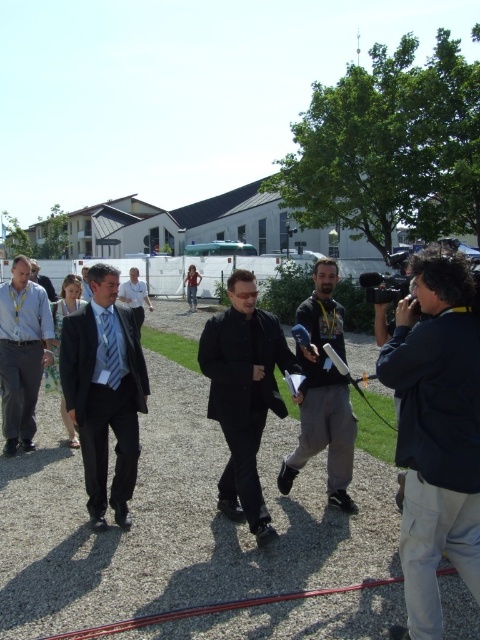
You are a photographer at the media event. You need to capture a photo of the light blue fabric suit at center and the striped fabric tie at center. Which one will appear larger in the photo?

The light blue fabric suit at center will appear larger in the photo because it is taller than the striped fabric tie at center.

You are a photographer at the event and want to capture a photo where both the black matte jacket at center and the light blue fabric suit at center are visible. Given their height difference, which one should you focus on to ensure both are in frame without cropping?

Since the black matte jacket at center is taller than the light blue fabric suit at center, you should focus on the black matte jacket at center to ensure both are fully visible in the frame.